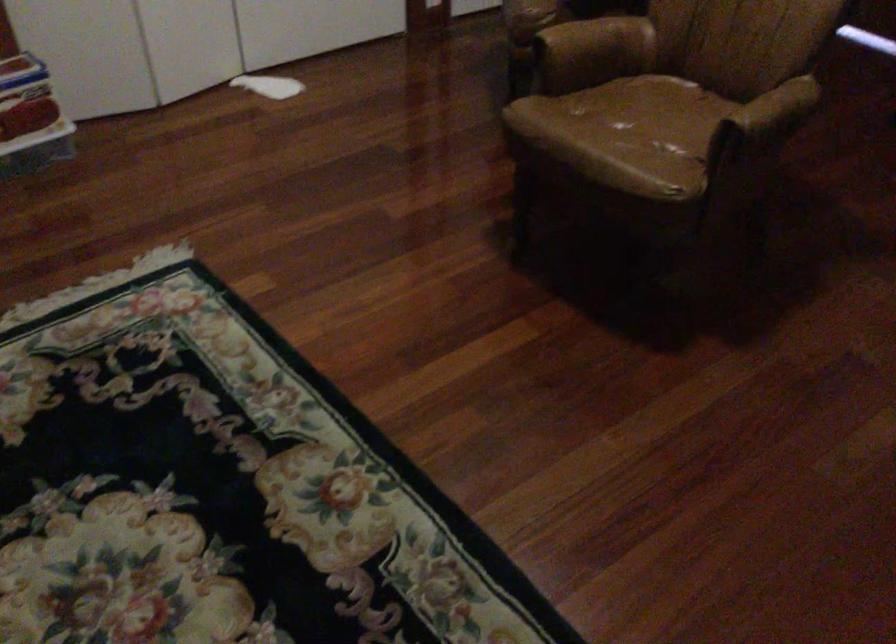
Where is `brown chair sitting surface`? brown chair sitting surface is located at coordinates (661, 109).